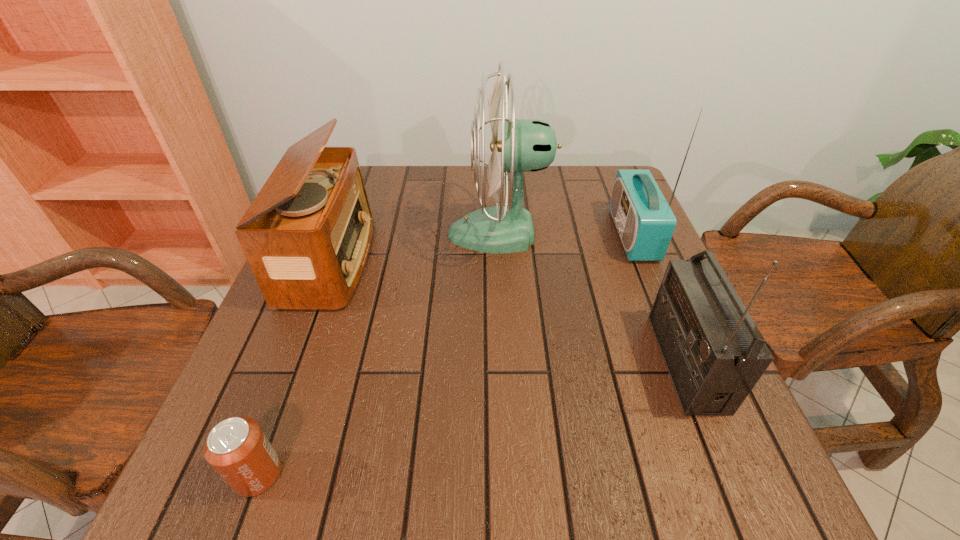
Identify the location of the tallest object. The width and height of the screenshot is (960, 540). (527, 145).

You are a GUI agent. You are given a task and a screenshot of the screen. Output one action in this format:
    pyautogui.click(x=<x>, y=<y>)
    Task: Click on the third object from left to right
    Image resolution: width=960 pixels, height=540 pixels.
    Given the screenshot: What is the action you would take?
    pyautogui.click(x=527, y=145)

Where is `the fourth farthest object`? The image size is (960, 540). the fourth farthest object is located at coordinates (715, 354).

You are a GUI agent. You are given a task and a screenshot of the screen. Output one action in this format:
    pyautogui.click(x=<x>, y=<y>)
    Task: Click on the shortest radio receiver
    
    Given the screenshot: What is the action you would take?
    pyautogui.click(x=307, y=234)

Identify the location of the leftmost radio receiver. This screenshot has width=960, height=540. (307, 234).

The image size is (960, 540). In order to click on can in this screenshot , I will do `click(237, 448)`.

This screenshot has width=960, height=540. Identify the location of the nearest object. (237, 448).

Find the location of a particular element. The image size is (960, 540). blank area located 0.290m in front of the tallest object, directing airflow is located at coordinates (333, 233).

Find the location of a particular element. free space located 0.270m in front of the tallest object, directing airflow is located at coordinates (342, 233).

Locate an element on the screen. This screenshot has height=540, width=960. free point located in front of the tallest object, directing airflow is located at coordinates tap(400, 233).